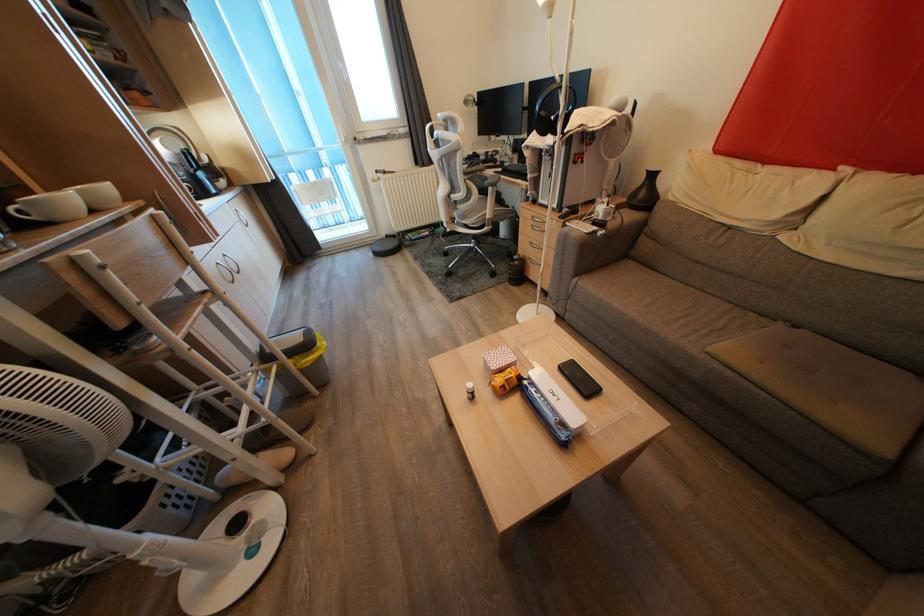
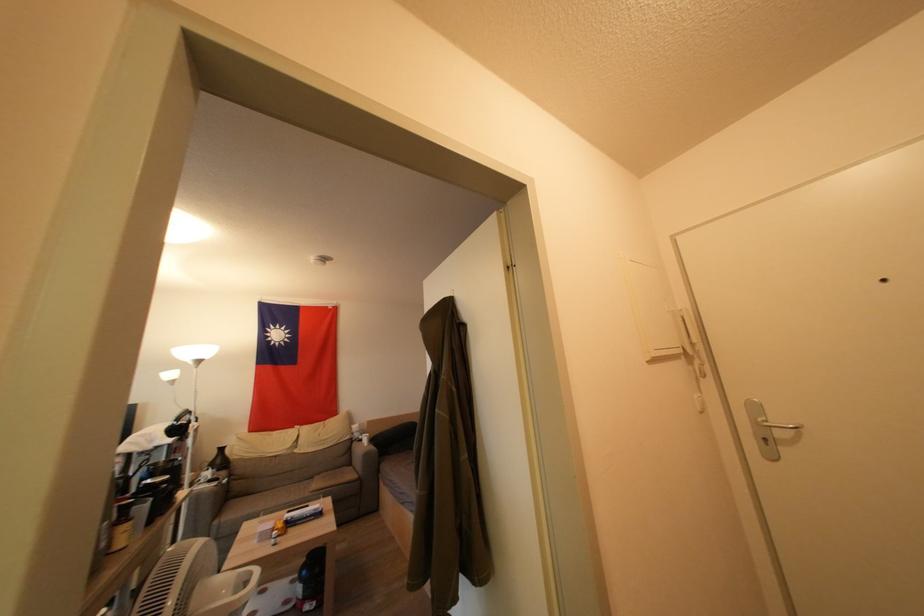
Where in the second image is the point corresponding to (579,284) from the first image?

(221, 525)